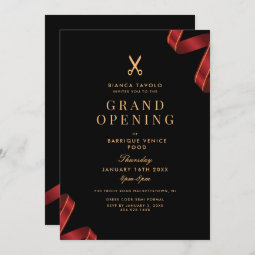
Find the location of a particular element. The height and width of the screenshot is (255, 255). marble-like background is located at coordinates (15, 168).